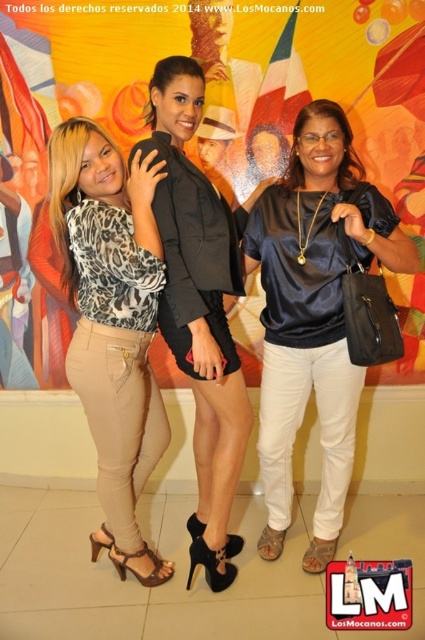
Question: Which of the following is the farthest from the observer?

Choices:
 (A) leopard print blouse at left
 (B) matte black blazer at center
 (C) satin black blouse at center

Answer: (B)

Question: Is matte black blazer at center closer to the viewer compared to leopard print blouse at left?

Choices:
 (A) no
 (B) yes

Answer: (A)

Question: Among these objects, which one is nearest to the camera?

Choices:
 (A) matte black blazer at center
 (B) satin black blouse at center

Answer: (B)

Question: Which point is farther from the camera taking this photo?

Choices:
 (A) (149, 28)
 (B) (127, 337)

Answer: (A)

Question: Is matte black blazer at center below leopard print blouse at left?

Choices:
 (A) no
 (B) yes

Answer: (A)

Question: Does matte black blazer at center have a larger size compared to leopard print blouse at left?

Choices:
 (A) yes
 (B) no

Answer: (A)